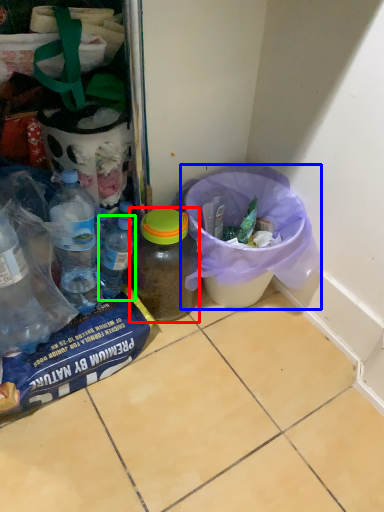
Question: Based on their relative distances, which object is nearer to bottle (highlighted by a red box)? Choose from recycling bin (highlighted by a blue box) and bottle (highlighted by a green box).

Choices:
 (A) recycling bin
 (B) bottle

Answer: (B)